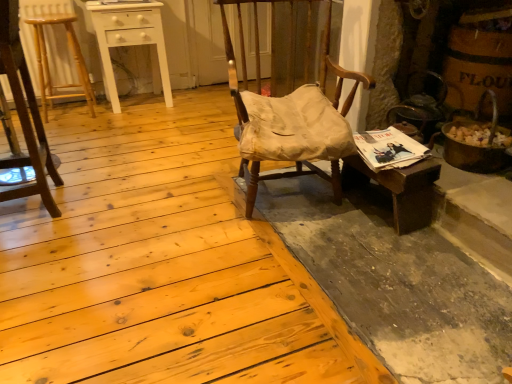
You are a GUI agent. You are given a task and a screenshot of the screen. Output one action in this format:
    pyautogui.click(x=<x>, y=<y>)
    Task: Click on the free space in front of white wood table at upper left
    
    Given the screenshot: What is the action you would take?
    pyautogui.click(x=126, y=123)